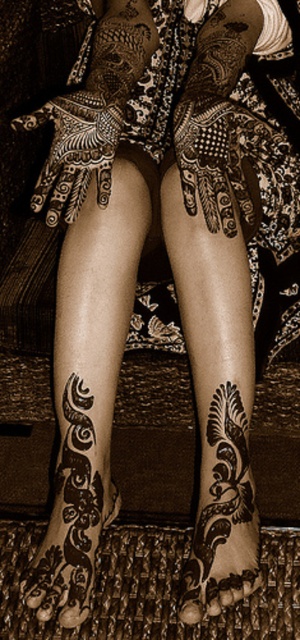
Is point (245, 618) positioned after point (72, 604)?

Yes.

In the scene shown: Can you confirm if woven mat at lower center is positioned to the left of brown henna tattoo at lower left?

Incorrect, woven mat at lower center is not on the left side of brown henna tattoo at lower left.

You are a GUI agent. You are given a task and a screenshot of the screen. Output one action in this format:
    pyautogui.click(x=<x>, y=<y>)
    Task: Click on the woven mat at lower center
    This screenshot has width=300, height=640.
    Given the screenshot: What is the action you would take?
    pyautogui.click(x=153, y=588)

Between woven mat at lower center and black henna tattoo at lower center, which one is positioned higher?

black henna tattoo at lower center is higher up.

Can you confirm if woven mat at lower center is taller than black henna tattoo at lower center?

No, woven mat at lower center is not taller than black henna tattoo at lower center.

Image resolution: width=300 pixels, height=640 pixels. In order to click on woven mat at lower center in this screenshot , I will do `click(153, 588)`.

Who is lower down, brown henna tattoo at lower left or black henna tattoo at lower center?

Positioned lower is black henna tattoo at lower center.

Between brown henna tattoo at lower left and black henna tattoo at lower center, which one is positioned higher?

brown henna tattoo at lower left is above.

Is point (105, 509) closer to camera compared to point (240, 573)?

No.

In order to click on brown henna tattoo at lower left in this screenshot , I will do `click(75, 500)`.